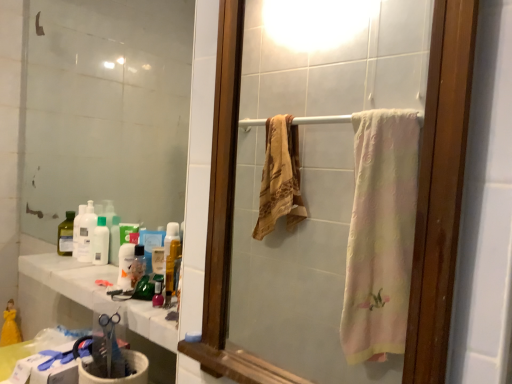
Question: Is the depth of translucent plastic bottle at lower center less than that of clear glass mirror at upper left, the 2th mirror in the right-to-left sequence?

Choices:
 (A) no
 (B) yes

Answer: (B)

Question: Can you confirm if translucent plastic bottle at lower center is positioned to the left of clear glass mirror at upper left, the 2th mirror in the right-to-left sequence?

Choices:
 (A) no
 (B) yes

Answer: (A)

Question: Is clear glass mirror at upper left, which is the second mirror in front-to-back order, at the back of translucent plastic bottle at lower center?

Choices:
 (A) yes
 (B) no

Answer: (B)

Question: From the image's perspective, is translucent plastic bottle at lower center on top of clear glass mirror at upper left, the 1th mirror in the left-to-right sequence?

Choices:
 (A) no
 (B) yes

Answer: (A)

Question: Considering the relative sizes of translucent plastic bottle at lower center and clear glass mirror at upper left, acting as the first mirror starting from the back, in the image provided, is translucent plastic bottle at lower center wider than clear glass mirror at upper left, acting as the first mirror starting from the back,?

Choices:
 (A) yes
 (B) no

Answer: (B)

Question: Is point (417, 16) closer or farther from the camera than point (141, 266)?

Choices:
 (A) farther
 (B) closer

Answer: (A)

Question: Considering the positions of wooden frame mirror at center, the 1th mirror in the front-to-back sequence, and translucent plastic bottle at center in the image, is wooden frame mirror at center, the 1th mirror in the front-to-back sequence, bigger or smaller than translucent plastic bottle at center?

Choices:
 (A) big
 (B) small

Answer: (A)

Question: Is wooden frame mirror at center, which ranks as the 2th mirror in back-to-front order, taller or shorter than translucent plastic bottle at center?

Choices:
 (A) short
 (B) tall

Answer: (B)

Question: From the image's perspective, is wooden frame mirror at center, which ranks as the 2th mirror in back-to-front order, located above or below translucent plastic bottle at center?

Choices:
 (A) below
 (B) above

Answer: (B)

Question: Is point (133, 286) positioned closer to the camera than point (97, 264)?

Choices:
 (A) farther
 (B) closer

Answer: (B)

Question: Is translucent plastic bottle at center spatially inside translucent plastic bottle at left, which is counted as the 1th cleaning product, starting from the right, or outside of it?

Choices:
 (A) outside
 (B) inside

Answer: (A)

Question: Considering the positions of translucent plastic bottle at center and translucent plastic bottle at left, which is counted as the 1th cleaning product, starting from the right, in the image, is translucent plastic bottle at center bigger or smaller than translucent plastic bottle at left, which is counted as the 1th cleaning product, starting from the right,?

Choices:
 (A) big
 (B) small

Answer: (B)

Question: From a real-world perspective, relative to translucent plastic bottle at left, placed as the 2th cleaning product when sorted from left to right, is translucent plastic bottle at center vertically above or below?

Choices:
 (A) below
 (B) above

Answer: (A)

Question: In terms of width, does translucent plastic bottle at lower center look wider or thinner when compared to white glossy countertop at lower left?

Choices:
 (A) thin
 (B) wide

Answer: (A)

Question: Would you say translucent plastic bottle at lower center is inside or outside white glossy countertop at lower left?

Choices:
 (A) inside
 (B) outside

Answer: (B)